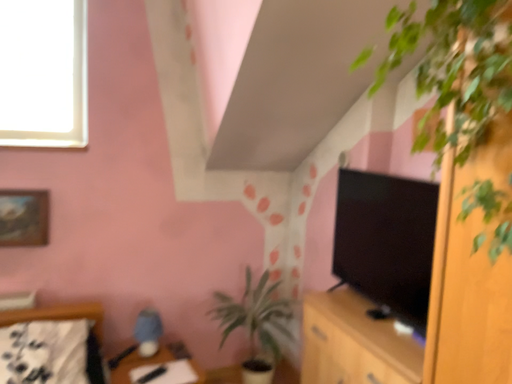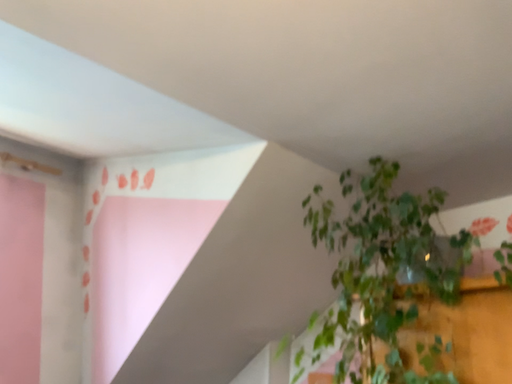
Question: How did the camera likely rotate when shooting the video?

Choices:
 (A) rotated right
 (B) rotated left

Answer: (A)